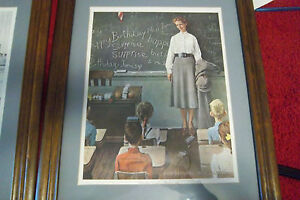
The image size is (300, 200). What are the coordinates of `blackboard` in the screenshot? It's located at (134, 21).